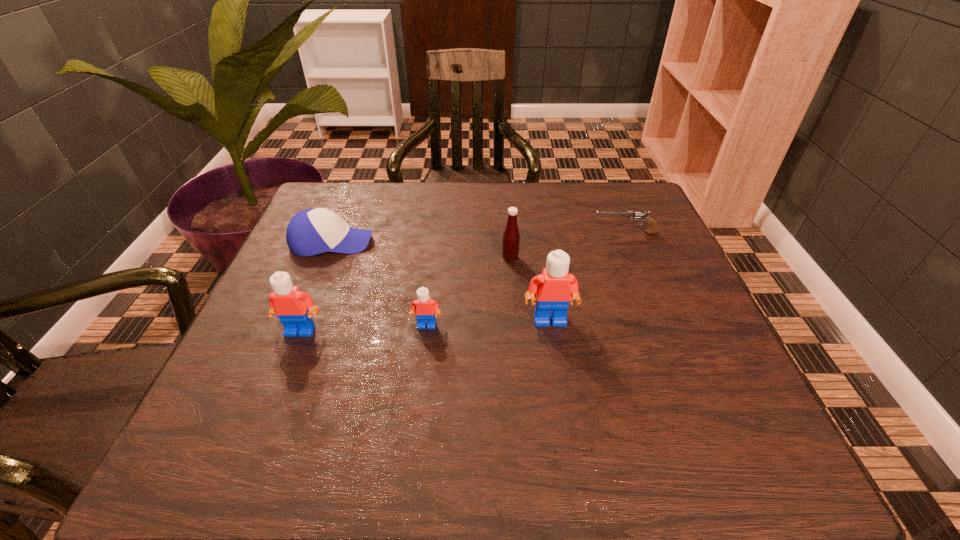
Image resolution: width=960 pixels, height=540 pixels. Find the location of `Lego that is the second nearest to the second shortest Lego`. Lego that is the second nearest to the second shortest Lego is located at coordinates (555, 287).

Identify which Lego is the second nearest to the Tabasco sauce. Please provide its 2D coordinates. Your answer should be formatted as a tuple, i.e. [(x, y)], where the tuple contains the x and y coordinates of a point satisfying the conditions above.

[(424, 307)]

Locate an element on the screen. The height and width of the screenshot is (540, 960). blank area in the image that satisfies the following two spatial constraints: 1. aiming along the barrel of the shortest object; 2. on the face of the rightmost Lego is located at coordinates (660, 320).

Locate an element on the screen. The width and height of the screenshot is (960, 540). free location that satisfies the following two spatial constraints: 1. aiming along the barrel of the shortest object; 2. on the face of the shortest Lego is located at coordinates (662, 325).

Identify the location of vacant position in the image that satisfies the following two spatial constraints: 1. aiming along the barrel of the shortest object; 2. on the face of the rightmost Lego. pos(660,320).

Find the location of a particular element. The image size is (960, 540). free location that satisfies the following two spatial constraints: 1. on the front-facing side of the fifth tallest object; 2. on the back side of the Tabasco sauce is located at coordinates (325, 258).